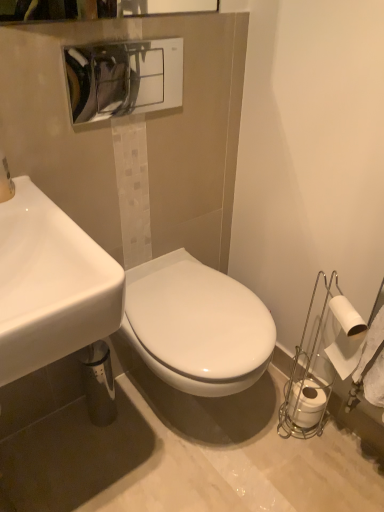
Locate an element on the screen. This screenshot has height=512, width=384. vacant space situated on the left part of white matte toilet paper at lower right, which is counted as the 2th toilet paper, starting from the top is located at coordinates (254, 422).